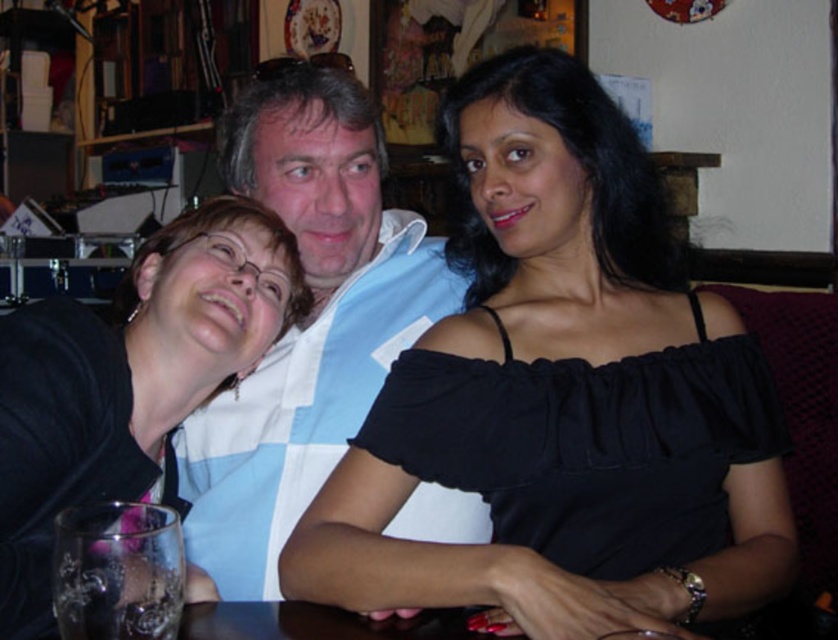
Which is behind, point (774, 499) or point (26, 577)?

Positioned behind is point (774, 499).

You are a GUI agent. You are given a task and a screenshot of the screen. Output one action in this format:
    pyautogui.click(x=<x>, y=<y>)
    Task: Click on the black satin blouse at center
    Image resolution: width=838 pixels, height=640 pixels.
    Given the screenshot: What is the action you would take?
    pyautogui.click(x=561, y=396)

Does white cotton shirt at center appear on the right side of black matte glass at left?

Indeed, white cotton shirt at center is positioned on the right side of black matte glass at left.

Between point (225, 403) and point (29, 552), which one is positioned in front?

Positioned in front is point (29, 552).

Identify the location of white cotton shirt at center. This screenshot has height=640, width=838. (306, 321).

Between black satin blouse at center and white cotton shirt at center, which one appears on the right side from the viewer's perspective?

black satin blouse at center is more to the right.

Does black satin blouse at center have a lesser height compared to white cotton shirt at center?

Yes.

Describe the element at coordinates (561, 396) in the screenshot. I see `black satin blouse at center` at that location.

Locate an element on the screen. The height and width of the screenshot is (640, 838). black satin blouse at center is located at coordinates (561, 396).